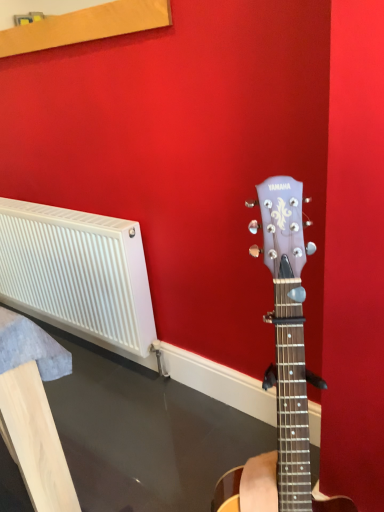
At what (x,y) coordinates should I click in order to perform the action: click on white plastic radiator at left. Please return your answer as a coordinate pair (x, y). Looking at the image, I should click on (33, 411).

Describe the element at coordinates (33, 411) in the screenshot. I see `white plastic radiator at left` at that location.

Describe the element at coordinates (78, 271) in the screenshot. The height and width of the screenshot is (512, 384). I see `white plastic radiator at left` at that location.

At what (x,y) coordinates should I click in order to perform the action: click on white plastic radiator at left. Please return your answer as a coordinate pair (x, y). Looking at the image, I should click on pyautogui.click(x=78, y=271).

At what (x,y) coordinates should I click in order to perform the action: click on white plastic radiator at left. Please return your answer as a coordinate pair (x, y). This screenshot has height=512, width=384. Looking at the image, I should click on (33, 411).

Considering the positions of objects white plastic radiator at left and white plastic radiator at left in the image provided, who is more to the right, white plastic radiator at left or white plastic radiator at left?

Positioned to the right is white plastic radiator at left.

Is white plastic radiator at left closer to the viewer compared to white plastic radiator at left?

Yes, white plastic radiator at left is closer to the viewer.

Considering the points (67, 476) and (144, 312), which point is in front, point (67, 476) or point (144, 312)?

Point (67, 476)

From the image's perspective, is white plastic radiator at left above or below white plastic radiator at left?

white plastic radiator at left is below white plastic radiator at left.

From a real-world perspective, who is located lower, white plastic radiator at left or white plastic radiator at left?

white plastic radiator at left is physically lower.

Considering the sizes of objects white plastic radiator at left and white plastic radiator at left in the image provided, who is thinner, white plastic radiator at left or white plastic radiator at left?

white plastic radiator at left.

Does white plastic radiator at left have a greater height compared to white plastic radiator at left?

Yes, white plastic radiator at left is taller than white plastic radiator at left.

Considering the relative sizes of white plastic radiator at left and white plastic radiator at left in the image provided, is white plastic radiator at left smaller than white plastic radiator at left?

Yes, white plastic radiator at left is smaller than white plastic radiator at left.

Is white plastic radiator at left inside the boundaries of white plastic radiator at left, or outside?

white plastic radiator at left is located beyond the bounds of white plastic radiator at left.

Is white plastic radiator at left with white plastic radiator at left?

No, white plastic radiator at left is not in contact with white plastic radiator at left.

Is white plastic radiator at left facing away from white plastic radiator at left?

Yes, white plastic radiator at left is facing away from white plastic radiator at left.

How many degrees apart are the facing directions of white plastic radiator at left and white plastic radiator at left?

The angle between the facing direction of white plastic radiator at left and the facing direction of white plastic radiator at left is 0.00197 degrees.

Locate an element on the screen. The width and height of the screenshot is (384, 512). furniture to the left of white plastic radiator at left is located at coordinates (33, 411).

Considering the relative positions of white plastic radiator at left and white plastic radiator at left in the image provided, is white plastic radiator at left to the right of white plastic radiator at left from the viewer's perspective?

Yes.

Considering the relative positions of white plastic radiator at left and white plastic radiator at left in the image provided, is white plastic radiator at left in front of white plastic radiator at left?

No.

Which is further, (44, 215) or (36, 505)?

The point (44, 215) is more distant.

From the image's perspective, which one is positioned lower, white plastic radiator at left or white plastic radiator at left?

white plastic radiator at left, from the image's perspective.

From a real-world perspective, is white plastic radiator at left above or below white plastic radiator at left?

From a real-world perspective, white plastic radiator at left is physically below white plastic radiator at left.

Looking at their sizes, would you say white plastic radiator at left is wider or thinner than white plastic radiator at left?

Considering their sizes, white plastic radiator at left looks slimmer than white plastic radiator at left.

Considering the sizes of objects white plastic radiator at left and white plastic radiator at left in the image provided, who is shorter, white plastic radiator at left or white plastic radiator at left?

With less height is white plastic radiator at left.

Looking at the image, does white plastic radiator at left seem bigger or smaller compared to white plastic radiator at left?

white plastic radiator at left is bigger than white plastic radiator at left.

Is white plastic radiator at left completely or partially outside of white plastic radiator at left?

white plastic radiator at left lies outside white plastic radiator at left's area.

Is white plastic radiator at left next to white plastic radiator at left and touching it?

No, white plastic radiator at left is not beside white plastic radiator at left.

Is white plastic radiator at left oriented towards white plastic radiator at left?

Yes.

Locate an element on the screen. furniture that is above the white plastic radiator at left (from a real-world perspective) is located at coordinates (33, 411).

Identify the location of furniture positioned vertically above the white plastic radiator at left (from a real-world perspective). (33, 411).

The image size is (384, 512). Identify the location of furniture on the left side of white plastic radiator at left. (33, 411).